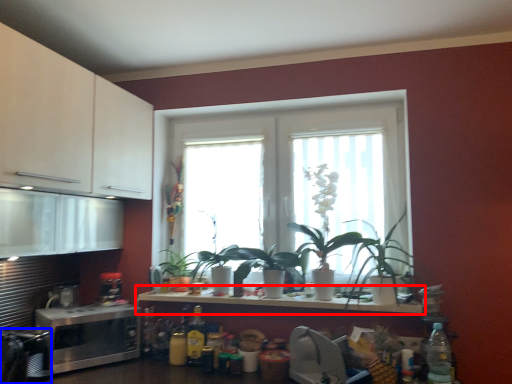
Question: Which point is further to the camera, countertop (highlighted by a red box) or appliance (highlighted by a blue box)?

Choices:
 (A) countertop
 (B) appliance

Answer: (A)